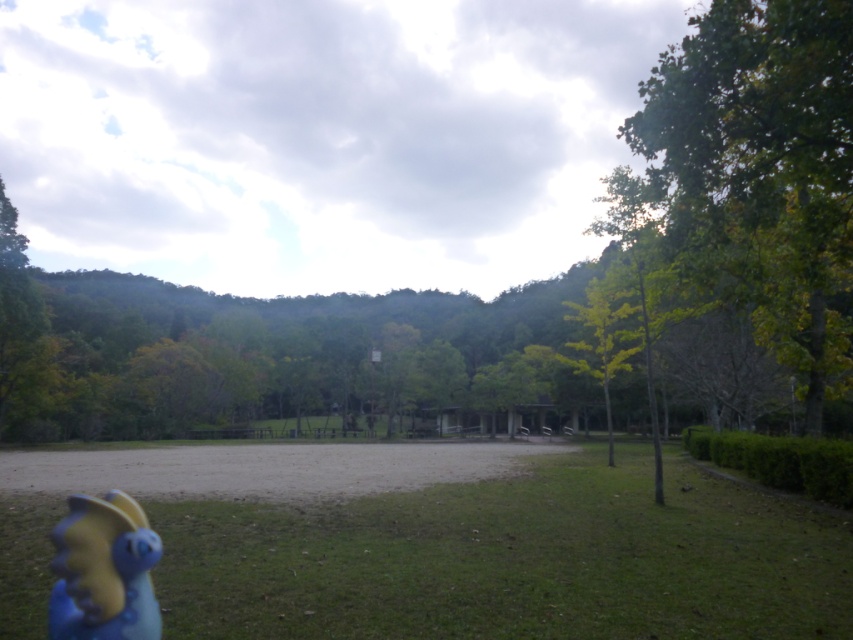
Question: Observing the image, what is the correct spatial positioning of green grass at center in reference to green leafy tree at right?

Choices:
 (A) left
 (B) right

Answer: (A)

Question: Among these objects, which one is farthest from the camera?

Choices:
 (A) yellow-green leaves at center-right
 (B) green leafy tree at right
 (C) green grass at center

Answer: (A)

Question: Is green leafy tree at right smaller than yellow-green leaves at center-right?

Choices:
 (A) yes
 (B) no

Answer: (B)

Question: Which of the following is the farthest from the observer?

Choices:
 (A) green leafy tree at right
 (B) green grass at center

Answer: (A)

Question: Which point is farther to the camera?

Choices:
 (A) (604, 340)
 (B) (802, 364)

Answer: (A)

Question: Does green grass at center appear under green leafy tree at right?

Choices:
 (A) no
 (B) yes

Answer: (B)